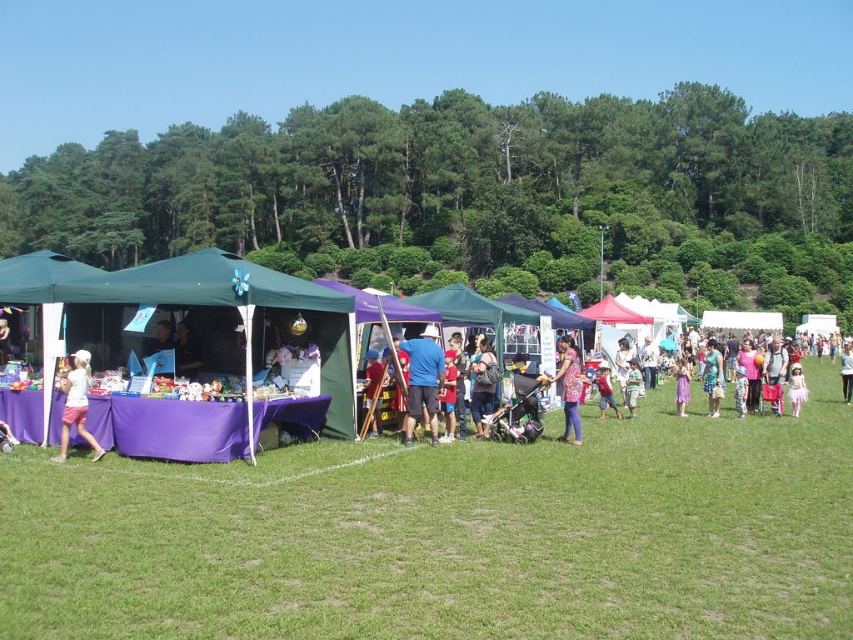
You are organizing a fashion show and need to decide which dress will require more space to display properly. Based on the image, which dress between the floral dress at center and the matte pink dress at center needs more space due to its size?

The floral dress at center requires more space because its width is larger than that of the matte pink dress at center.

You are standing in the outdoor market and want to visit both the purple fabric tent at left and the purple fabric tent at center. Which tent should you approach first to be closer to your starting position?

The purple fabric tent at left is closer to the viewer than the purple fabric tent at center, so you should approach the purple fabric tent at left first as it is nearer to your current position.

You are a vendor at the outdoor market and want to display two dresses on a narrow rack. You have a white matte dress at lower left and a purple cotton dress at center. Which dress will require less space on the rack?

The white matte dress at lower left is thinner than the purple cotton dress at center, so it will require less space on the rack.